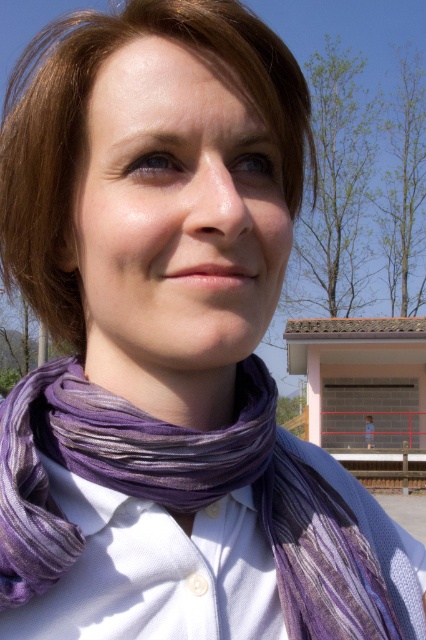
Question: Among these objects, which one is nearest to the camera?

Choices:
 (A) brownhair at upper left
 (B) purple fabric at center

Answer: (B)

Question: Does purple striped scarf at center appear under brownhair at upper left?

Choices:
 (A) yes
 (B) no

Answer: (A)

Question: Observing the image, what is the correct spatial positioning of purple striped scarf at center in reference to purple fabric at center?

Choices:
 (A) right
 (B) left

Answer: (A)

Question: Which object appears closest to the camera in this image?

Choices:
 (A) purple striped scarf at center
 (B) purple woven scarf at center

Answer: (A)

Question: Does purple striped scarf at center appear on the left side of brownhair at upper left?

Choices:
 (A) yes
 (B) no

Answer: (B)

Question: Which object appears farthest from the camera in this image?

Choices:
 (A) purple striped scarf at center
 (B) brownhair at upper left
 (C) purple fabric at center

Answer: (A)